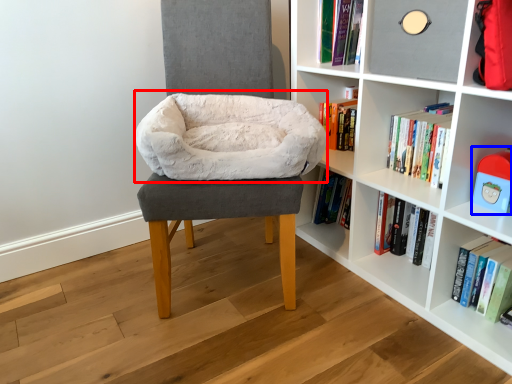
Question: Which of the following is the farthest to the observer, bean bag chair (highlighted by a red box) or toy (highlighted by a blue box)?

Choices:
 (A) bean bag chair
 (B) toy

Answer: (A)